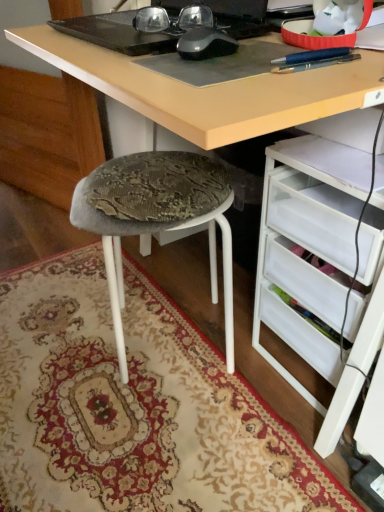
What do you see at coordinates (134, 406) in the screenshot? This screenshot has width=384, height=512. I see `carpeted rug at lower left` at bounding box center [134, 406].

Find the location of a particular element. Image resolution: width=384 pixels, height=512 pixels. white plastic drawers at lower right is located at coordinates (318, 252).

Does matte black glasses at upper center appear on the left side of textured fabric stool at lower left?

In fact, matte black glasses at upper center is to the right of textured fabric stool at lower left.

Considering the positions of point (186, 19) and point (111, 275), is point (186, 19) closer or farther from the camera than point (111, 275)?

Point (186, 19) is positioned closer to the camera compared to point (111, 275).

From the image's perspective, relative to textured fabric stool at lower left, is matte black glasses at upper center above or below?

Based on their image positions, matte black glasses at upper center is located above textured fabric stool at lower left.

Would you say matte black glasses at upper center is inside or outside textured fabric stool at lower left?

matte black glasses at upper center is not inside textured fabric stool at lower left, it's outside.

You are a GUI agent. You are given a task and a screenshot of the screen. Output one action in this format:
    pyautogui.click(x=<x>, y=<y>)
    Task: Click on the glasses behind the black matte mouse at center
    This screenshot has width=384, height=512.
    Given the screenshot: What is the action you would take?
    pyautogui.click(x=172, y=19)

From a real-world perspective, is matte black glasses at upper center beneath black matte mouse at center?

No, from a real-world perspective, matte black glasses at upper center is not below black matte mouse at center.

Does matte black glasses at upper center lie in front of black matte mouse at center?

No, it is behind black matte mouse at center.

From a real-world perspective, is white plastic drawers at lower right positioned under textured fabric stool at lower left based on gravity?

No, from a real-world perspective, white plastic drawers at lower right is not under textured fabric stool at lower left.

From the image's perspective, which is below, white plastic drawers at lower right or textured fabric stool at lower left?

white plastic drawers at lower right, from the image's perspective.

Is white plastic drawers at lower right smaller than textured fabric stool at lower left?

Correct, white plastic drawers at lower right occupies less space than textured fabric stool at lower left.

Does carpeted rug at lower left turn towards white plastic drawers at lower right?

No.

Which of these two, carpeted rug at lower left or white plastic drawers at lower right, is bigger?

Bigger between the two is white plastic drawers at lower right.

Considering the sizes of carpeted rug at lower left and white plastic drawers at lower right in the image, is carpeted rug at lower left taller or shorter than white plastic drawers at lower right?

Clearly, carpeted rug at lower left is shorter compared to white plastic drawers at lower right.

Does carpeted rug at lower left lie behind white plastic drawers at lower right?

No, it is not.

Relative to white plastic drawers at lower right, is matte black glasses at upper center in front or behind?

Visually, matte black glasses at upper center is located behind white plastic drawers at lower right.

In the scene shown: From a real-world perspective, relative to white plastic drawers at lower right, is matte black glasses at upper center vertically above or below?

In terms of real-world spatial position, matte black glasses at upper center is above white plastic drawers at lower right.

How different are the orientations of matte black glasses at upper center and white plastic drawers at lower right in degrees?

42.3 degrees separate the facing orientations of matte black glasses at upper center and white plastic drawers at lower right.

Is matte black glasses at upper center facing away from white plastic drawers at lower right?

No, matte black glasses at upper center's orientation is not away from white plastic drawers at lower right.

Is white plastic drawers at lower right to the left or to the right of black matte mouse at center in the image?

From the image, it's evident that white plastic drawers at lower right is to the right of black matte mouse at center.

Are white plastic drawers at lower right and black matte mouse at center making contact?

No, white plastic drawers at lower right is not touching black matte mouse at center.

Is point (282, 231) positioned in front of point (181, 41)?

No, (282, 231) is behind (181, 41).

Could black matte mouse at center be considered to be inside white plastic drawers at lower right?

No.

Based on their sizes in the image, would you say carpeted rug at lower left is bigger or smaller than matte black glasses at upper center?

Clearly, carpeted rug at lower left is larger in size than matte black glasses at upper center.

The image size is (384, 512). I want to click on mat in front of the matte black glasses at upper center, so click(x=134, y=406).

Does carpeted rug at lower left have a greater height compared to matte black glasses at upper center?

No, carpeted rug at lower left is not taller than matte black glasses at upper center.

From the image's perspective, is carpeted rug at lower left located beneath matte black glasses at upper center?

Yes.

What are the coordinates of `stool behind the matte black glasses at upper center` in the screenshot? It's located at (156, 217).

The height and width of the screenshot is (512, 384). What are the coordinates of `mouse below the matte black glasses at upper center (from a real-world perspective)` in the screenshot? It's located at (205, 42).

Considering their positions, is matte black glasses at upper center positioned further to carpeted rug at lower left than white plastic drawers at lower right?

matte black glasses at upper center is positioned further to the anchor carpeted rug at lower left.

Looking at the image, which one is located further to carpeted rug at lower left, black matte mouse at center or textured fabric stool at lower left?

black matte mouse at center.

Based on their spatial positions, is white plastic drawers at lower right or black matte mouse at center closer to textured fabric stool at lower left?

The object closer to textured fabric stool at lower left is white plastic drawers at lower right.

Considering their positions, is textured fabric stool at lower left positioned further to white plastic drawers at lower right than matte black glasses at upper center?

matte black glasses at upper center lies further to white plastic drawers at lower right than the other object.

Considering their positions, is white plastic drawers at lower right positioned further to matte black glasses at upper center than textured fabric stool at lower left?

white plastic drawers at lower right is positioned further to the anchor matte black glasses at upper center.

Estimate the real-world distances between objects in this image. Which object is further from textured fabric stool at lower left, black matte mouse at center or carpeted rug at lower left?

Among the two, black matte mouse at center is located further to textured fabric stool at lower left.

Looking at the image, which one is located further to carpeted rug at lower left, textured fabric stool at lower left or black matte mouse at center?

black matte mouse at center is further to carpeted rug at lower left.

When comparing their distances from carpeted rug at lower left, does textured fabric stool at lower left or white plastic drawers at lower right seem closer?

Based on the image, textured fabric stool at lower left appears to be nearer to carpeted rug at lower left.

Where is `file cabinet between matte black glasses at upper center and carpeted rug at lower left in the vertical direction`? This screenshot has height=512, width=384. file cabinet between matte black glasses at upper center and carpeted rug at lower left in the vertical direction is located at coordinates (318, 252).

Find the location of a particular element. This screenshot has width=384, height=512. mouse situated between textured fabric stool at lower left and white plastic drawers at lower right from left to right is located at coordinates (205, 42).

Identify the location of file cabinet between black matte mouse at center and carpeted rug at lower left from top to bottom. (318, 252).

Locate an element on the screen. Image resolution: width=384 pixels, height=512 pixels. stool located between carpeted rug at lower left and white plastic drawers at lower right in the left-right direction is located at coordinates (156, 217).